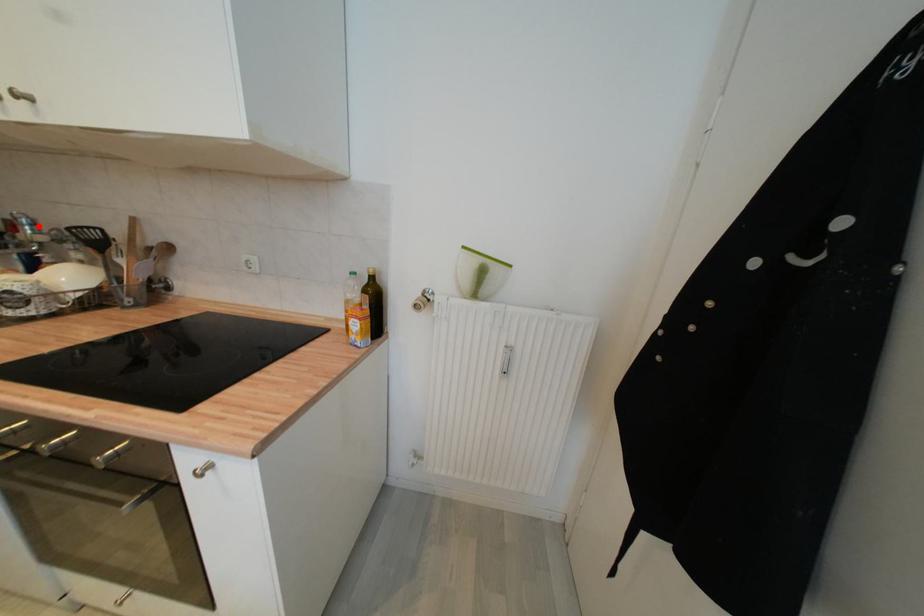
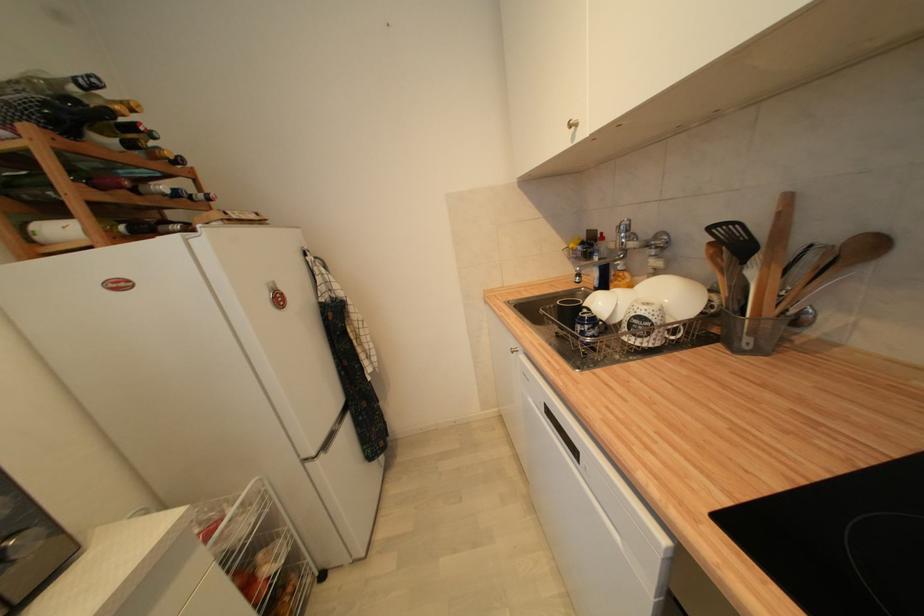
Find the pixel in the second image that matches the highlighted location in the first image.

(633, 233)